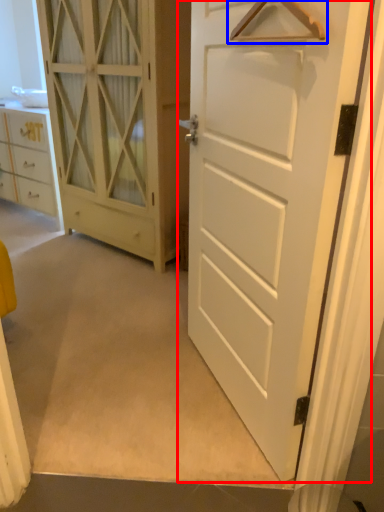
Question: Among these objects, which one is farthest to the camera, door (highlighted by a red box) or hanger (highlighted by a blue box)?

Choices:
 (A) door
 (B) hanger

Answer: (A)